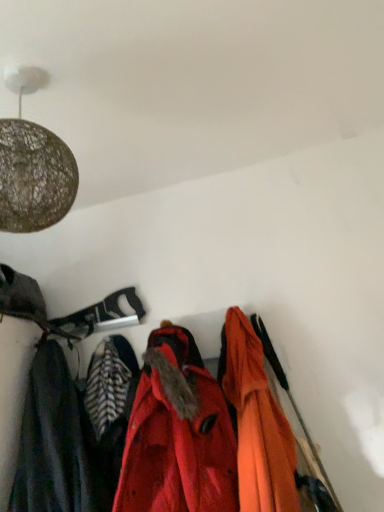
Question: Considering the positions of point (276, 501) and point (147, 457), is point (276, 501) closer or farther from the camera than point (147, 457)?

Choices:
 (A) closer
 (B) farther

Answer: (A)

Question: Is orange matte jacket at center, the 1th jacket positioned from the right, in front of or behind red matte jacket at center, placed as the first jacket when sorted from left to right, in the image?

Choices:
 (A) behind
 (B) front

Answer: (A)

Question: Estimate the real-world distances between objects in this image. Which object is closer to the dark gray fabric at left?

Choices:
 (A) orange matte jacket at center, positioned as the second jacket in left-to-right order
 (B) red matte jacket at center, placed as the first jacket when sorted from left to right

Answer: (B)

Question: Considering the real-world distances, which object is farthest from the dark gray fabric at left?

Choices:
 (A) orange matte jacket at center, the 1th jacket positioned from the right
 (B) red matte jacket at center, the 2th jacket positioned from the right

Answer: (A)